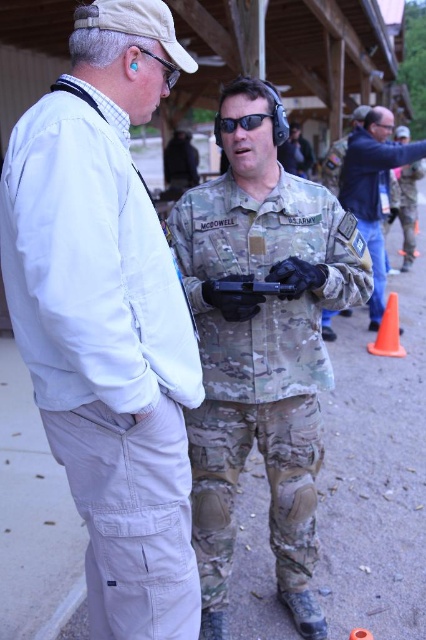
You are a photographer positioned at the center of the image. You need to capture a photo that includes both the camouflage uniform at right and the orange matte cone at lower right. Which object should you adjust your camera angle to focus on first to ensure both are in frame?

Since the camouflage uniform at right might be wider than orange matte cone at lower right, you should focus on the camouflage uniform at right first to ensure both fit within the frame.